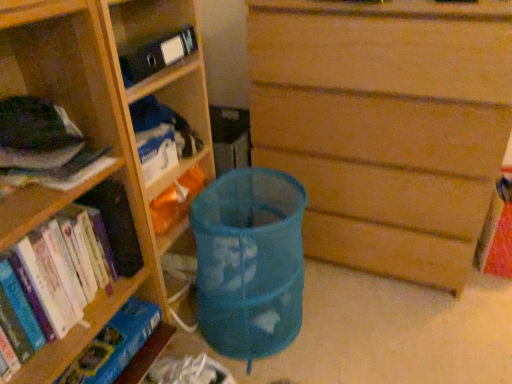
Question: Can you confirm if wooden chest of drawers at center is wider than blue mesh bag at center?

Choices:
 (A) yes
 (B) no

Answer: (A)

Question: From the image's perspective, is wooden chest of drawers at center on top of blue mesh bag at center?

Choices:
 (A) no
 (B) yes

Answer: (B)

Question: From a real-world perspective, is wooden chest of drawers at center located beneath blue mesh bag at center?

Choices:
 (A) yes
 (B) no

Answer: (B)

Question: Considering the relative sizes of wooden chest of drawers at center and blue mesh bag at center in the image provided, is wooden chest of drawers at center smaller than blue mesh bag at center?

Choices:
 (A) no
 (B) yes

Answer: (A)

Question: From a real-world perspective, is wooden chest of drawers at center located higher than blue mesh bag at center?

Choices:
 (A) yes
 (B) no

Answer: (A)

Question: Considering the relative sizes of wooden chest of drawers at center and blue mesh bag at center in the image provided, is wooden chest of drawers at center taller than blue mesh bag at center?

Choices:
 (A) yes
 (B) no

Answer: (A)

Question: Is hardcover book at left, which is the first book from top to bottom, oriented towards blue mesh bag at center?

Choices:
 (A) no
 (B) yes

Answer: (A)

Question: Considering the relative positions of hardcover book at left, placed as the second book when sorted from bottom to top, and blue mesh bag at center in the image provided, is hardcover book at left, placed as the second book when sorted from bottom to top, in front of blue mesh bag at center?

Choices:
 (A) yes
 (B) no

Answer: (A)

Question: Is hardcover book at left, which is the first book from top to bottom, turned away from blue mesh bag at center?

Choices:
 (A) yes
 (B) no

Answer: (B)

Question: Can you confirm if hardcover book at left, which is the first book from top to bottom, is shorter than blue mesh bag at center?

Choices:
 (A) yes
 (B) no

Answer: (A)

Question: Is hardcover book at left, placed as the second book when sorted from bottom to top, positioned far away from blue mesh bag at center?

Choices:
 (A) yes
 (B) no

Answer: (B)

Question: Does hardcover book at left, which is the first book from top to bottom, come behind blue mesh bag at center?

Choices:
 (A) no
 (B) yes

Answer: (A)

Question: Is hardcover book at left, which is the first book from top to bottom, positioned behind wooden chest of drawers at center?

Choices:
 (A) yes
 (B) no

Answer: (B)